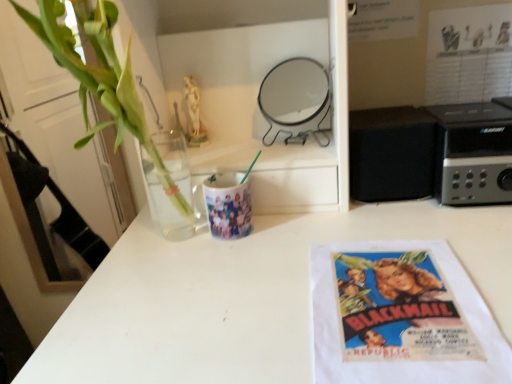
Question: Does black plastic stereo at right, the first appliance when ordered from right to left, have a lesser width compared to metallic round mirror at upper center, which is counted as the 1th appliance, starting from the left?

Choices:
 (A) yes
 (B) no

Answer: (B)

Question: Is black plastic stereo at right, arranged as the third appliance when viewed from the left, facing away from metallic round mirror at upper center, which is counted as the 1th appliance, starting from the left?

Choices:
 (A) no
 (B) yes

Answer: (A)

Question: Is the position of black plastic stereo at right, arranged as the third appliance when viewed from the left, less distant than that of metallic round mirror at upper center, the third appliance from the right?

Choices:
 (A) yes
 (B) no

Answer: (A)

Question: Is black plastic stereo at right, the first appliance when ordered from right to left, placed right next to metallic round mirror at upper center, which is counted as the 1th appliance, starting from the left?

Choices:
 (A) no
 (B) yes

Answer: (A)

Question: Can you confirm if black plastic stereo at right, arranged as the third appliance when viewed from the left, is positioned to the right of metallic round mirror at upper center, the third appliance from the right?

Choices:
 (A) no
 (B) yes

Answer: (B)

Question: In terms of width, does black matte speaker at right, which ranks as the 2th appliance in left-to-right order, look wider or thinner when compared to white paper towel at lower right?

Choices:
 (A) thin
 (B) wide

Answer: (A)

Question: Based on their sizes in the image, would you say black matte speaker at right, the second appliance positioned from the right, is bigger or smaller than white paper towel at lower right?

Choices:
 (A) small
 (B) big

Answer: (B)

Question: Does point (374, 195) appear closer or farther from the camera than point (374, 306)?

Choices:
 (A) farther
 (B) closer

Answer: (A)

Question: Do you think black matte speaker at right, the second appliance positioned from the right, is within white paper towel at lower right, or outside of it?

Choices:
 (A) outside
 (B) inside

Answer: (A)

Question: Does point (320, 142) appear closer or farther from the camera than point (84, 79)?

Choices:
 (A) closer
 (B) farther

Answer: (B)

Question: Looking at the image, does metallic round mirror at upper center, the third appliance from the right, seem bigger or smaller compared to green leafy plant at left?

Choices:
 (A) small
 (B) big

Answer: (A)

Question: Is metallic round mirror at upper center, which is counted as the 1th appliance, starting from the left, to the left or to the right of green leafy plant at left in the image?

Choices:
 (A) left
 (B) right

Answer: (B)

Question: Is metallic round mirror at upper center, which is counted as the 1th appliance, starting from the left, wider or thinner than green leafy plant at left?

Choices:
 (A) thin
 (B) wide

Answer: (A)

Question: Is white paper towel at lower right inside the boundaries of vintage paper poster at upper right, or outside?

Choices:
 (A) inside
 (B) outside

Answer: (B)

Question: Is white paper towel at lower right bigger or smaller than vintage paper poster at upper right?

Choices:
 (A) big
 (B) small

Answer: (B)